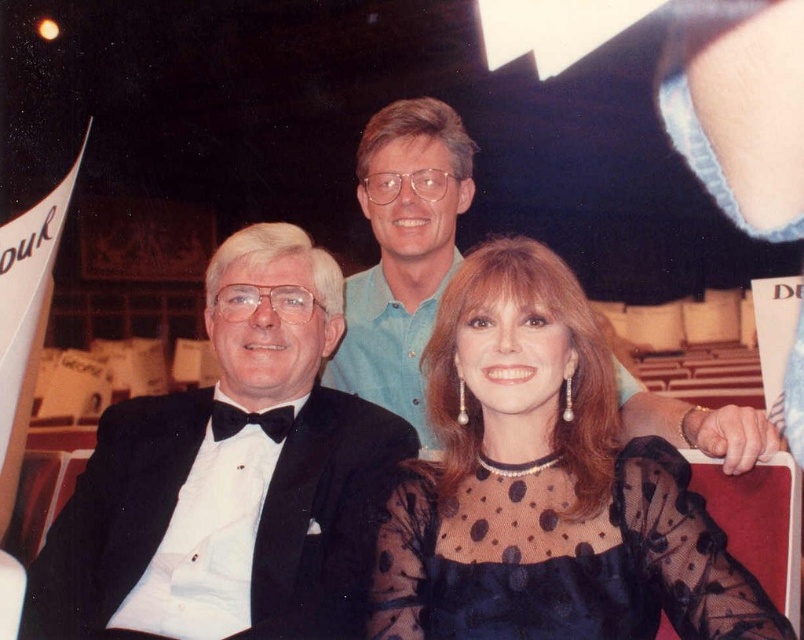
Between point (585, 413) and point (460, 202), which one is positioned behind?

The point (460, 202) is more distant.

Image resolution: width=804 pixels, height=640 pixels. I want to click on black sheer dress at center, so click(546, 484).

Is point (613, 572) less distant than point (347, 422)?

Yes, it is in front of point (347, 422).

Can you confirm if black sheer dress at center is positioned to the left of black satin tuxedo at left?

Incorrect, black sheer dress at center is not on the left side of black satin tuxedo at left.

The height and width of the screenshot is (640, 804). What do you see at coordinates (546, 484) in the screenshot?
I see `black sheer dress at center` at bounding box center [546, 484].

The width and height of the screenshot is (804, 640). I want to click on black sheer dress at center, so click(x=546, y=484).

Is black satin tuxedo at left further to camera compared to light blue shirt at upper center?

No, black satin tuxedo at left is closer to the viewer.

Is black satin tuxedo at left to the left of light blue shirt at upper center from the viewer's perspective?

Yes, black satin tuxedo at left is to the left of light blue shirt at upper center.

Does point (144, 515) come closer to viewer compared to point (741, 444)?

No, (144, 515) is behind (741, 444).

Locate an element on the screen. black satin tuxedo at left is located at coordinates (230, 476).